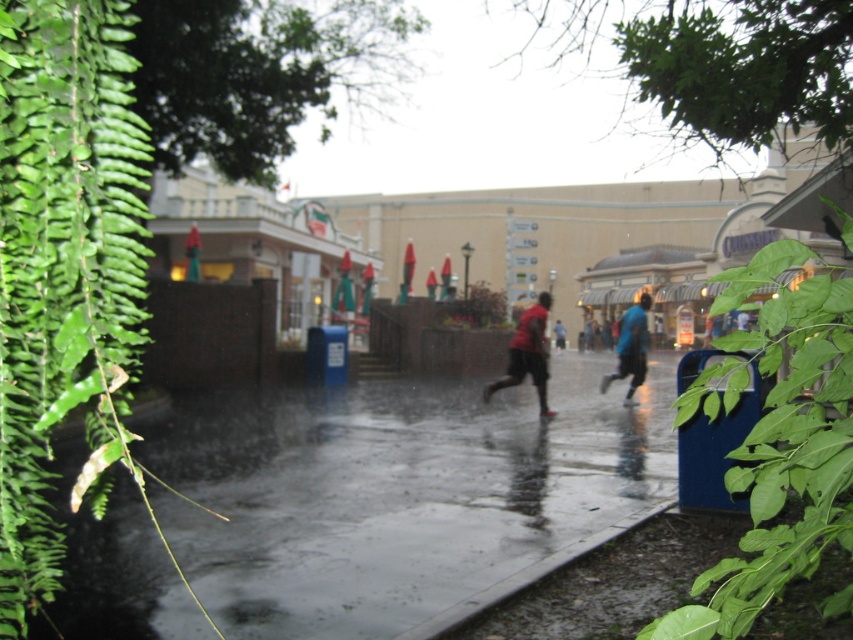
You are standing at the point marked as point (631, 348) in the image. You want to walk to the nearest umbrella. Which direction should you walk to reach the nearest umbrella?

The point (631, 348) is on blue matte jacket at right. The nearest umbrella is located in the middle ground along the low wall. To reach it, you should walk towards the middle ground from the blue matte jacket at right.

You are a delivery person who needs to deliver a package to the blue fabric jacket at center. You are currently standing at the blue matte jacket at right. Which direction should you move to reach your destination?

The blue matte jacket at right is positioned on the right side of blue fabric jacket at center, so you need to move to the left to reach the blue fabric jacket at center from the blue matte jacket at right.